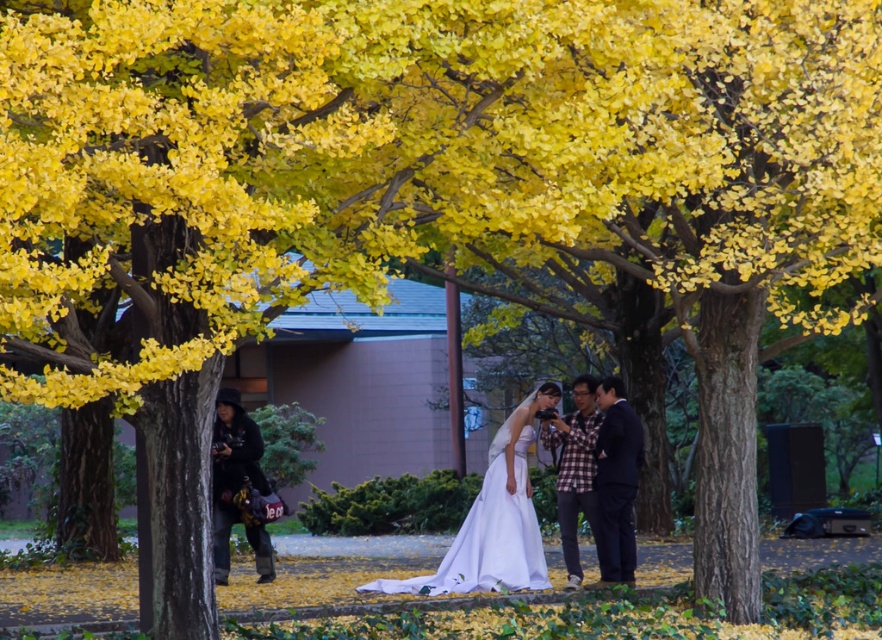
Is point (357, 252) positioned behind point (484, 536)?

That is False.

Does yellow leafy tree at center have a lesser height compared to white satin dress at center?

Incorrect, yellow leafy tree at center's height does not fall short of white satin dress at center's.

Find the location of a particular element. Image resolution: width=882 pixels, height=640 pixels. yellow leafy tree at center is located at coordinates (183, 211).

Locate an element on the screen. Image resolution: width=882 pixels, height=640 pixels. yellow leafy tree at center is located at coordinates (183, 211).

Is white satin dress at center taller than plaid fabric shirt at center?

Incorrect, white satin dress at center's height is not larger of plaid fabric shirt at center's.

Can you confirm if white satin dress at center is wider than plaid fabric shirt at center?

Yes, white satin dress at center is wider than plaid fabric shirt at center.

This screenshot has height=640, width=882. Describe the element at coordinates (492, 520) in the screenshot. I see `white satin dress at center` at that location.

Identify the location of white satin dress at center. Image resolution: width=882 pixels, height=640 pixels. (492, 520).

Does point (13, 301) lie behind point (602, 400)?

That is False.

Which of these two, yellow leafy tree at center or dark blue suit at center, stands shorter?

dark blue suit at center is shorter.

Who is more forward, (114, 355) or (604, 404)?

Positioned in front is point (604, 404).

Locate an element on the screen. The image size is (882, 640). yellow leafy tree at center is located at coordinates (183, 211).